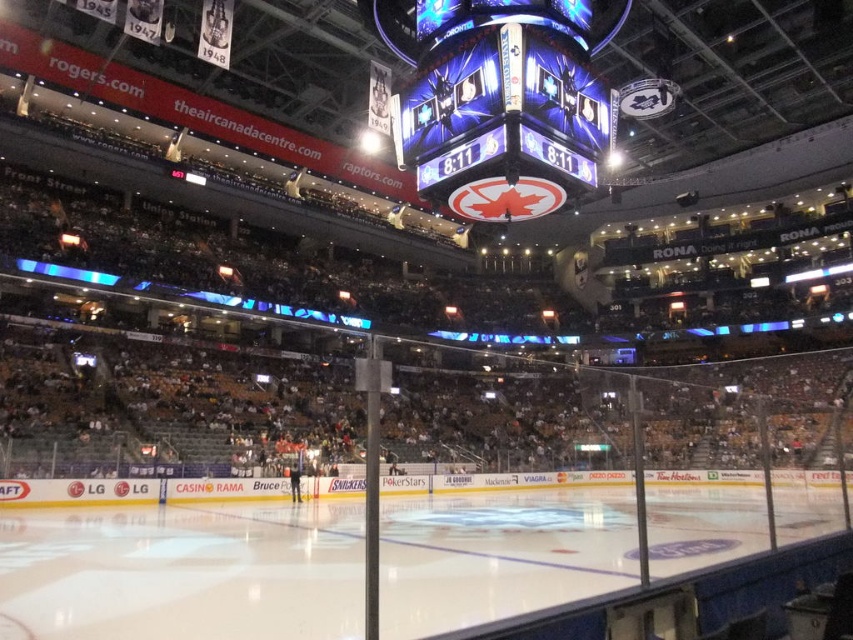
Who is lower down, white smooth ice at center or shiny digital display at center?

Positioned lower is white smooth ice at center.

Is white smooth ice at center positioned in front of shiny digital display at center?

Yes, white smooth ice at center is closer to the viewer.

Who is more distant from viewer, (172, 586) or (451, 104)?

The point (451, 104) is behind.

This screenshot has width=853, height=640. Find the location of `white smooth ice at center`. white smooth ice at center is located at coordinates [x=181, y=561].